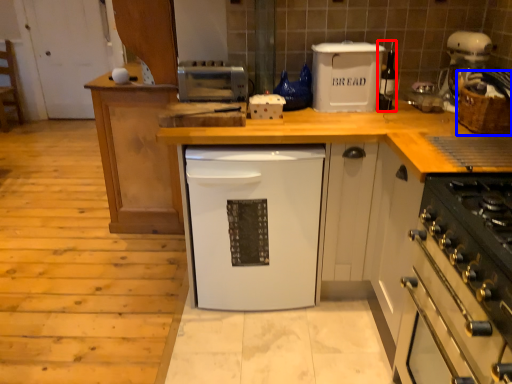
Question: Which object appears closest to the camera in this image, appliance (highlighted by a red box) or basket (highlighted by a blue box)?

Choices:
 (A) appliance
 (B) basket

Answer: (B)